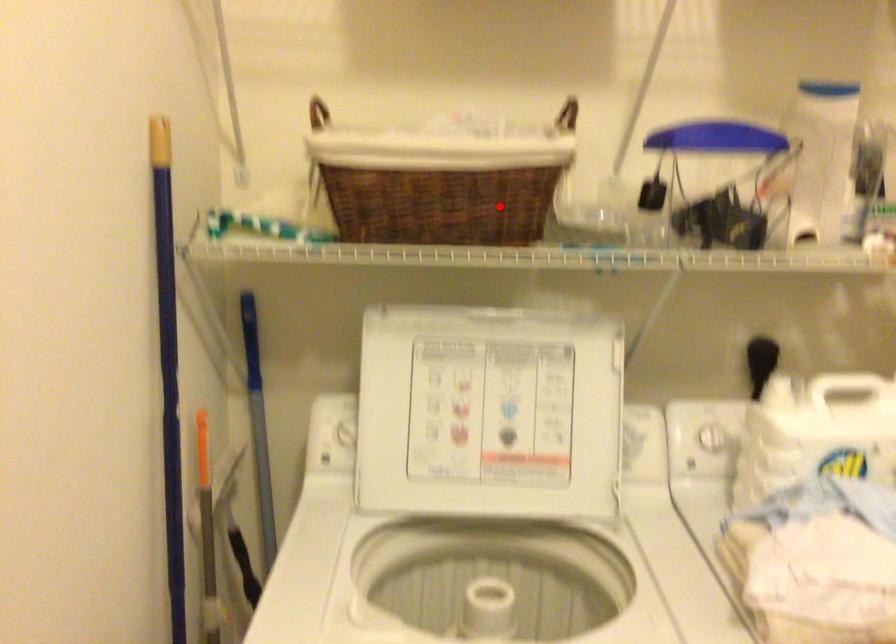
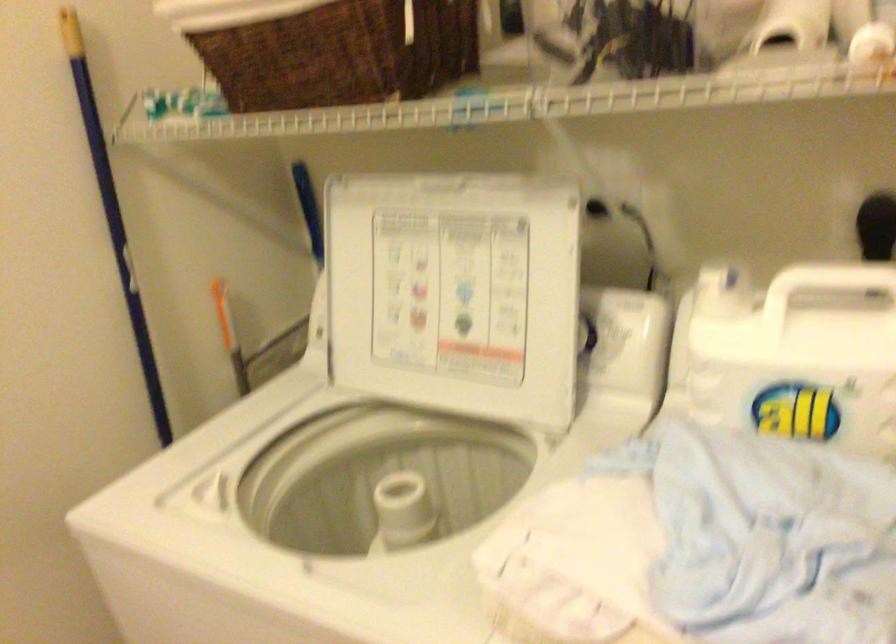
Question: I am providing you with two images of the same scene from different viewpoints. A red point is shown in image1. For the corresponding object point in image2, is it positioned nearer or farther from the camera?

Choices:
 (A) Nearer
 (B) Farther

Answer: (A)